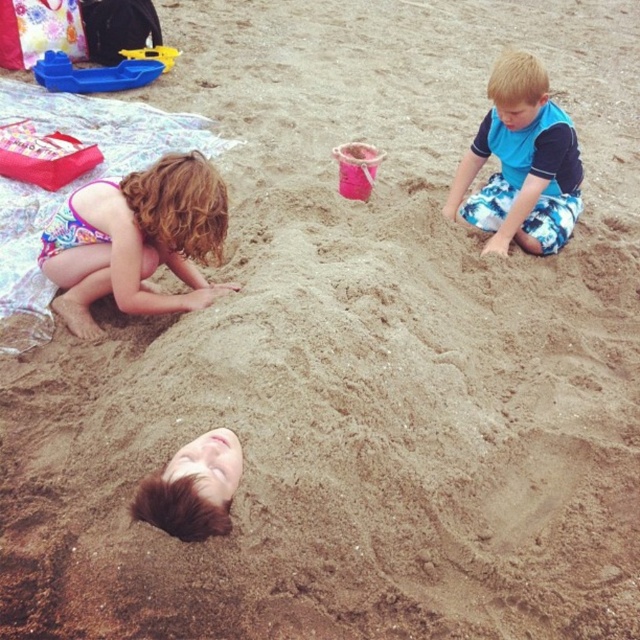
This screenshot has height=640, width=640. In order to click on multicolored swimsuit at lower left in this screenshot , I will do `click(136, 241)`.

Which is behind, point (147, 189) or point (497, 179)?

Point (497, 179)

This screenshot has height=640, width=640. In order to click on multicolored swimsuit at lower left in this screenshot , I will do `click(136, 241)`.